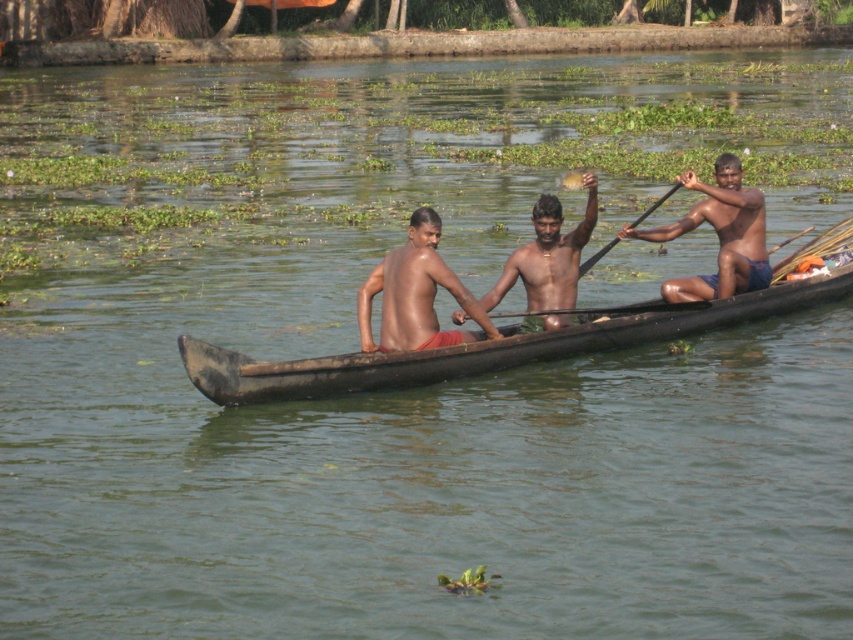
This screenshot has height=640, width=853. Describe the element at coordinates (415, 292) in the screenshot. I see `matte skin man at center` at that location.

This screenshot has height=640, width=853. What are the coordinates of `matte skin man at center` in the screenshot? It's located at (415, 292).

At what (x,y) coordinates should I click in order to perform the action: click on matte skin man at center. Please return your answer as a coordinate pair (x, y). Looking at the image, I should click on pos(415,292).

Can you confirm if dark brown wooden boat at center is taller than brown skin man at center?

Incorrect, dark brown wooden boat at center's height is not larger of brown skin man at center's.

Which is more to the left, dark brown wooden boat at center or brown skin man at center?

Positioned to the left is dark brown wooden boat at center.

Identify the location of dark brown wooden boat at center. The width and height of the screenshot is (853, 640). (492, 346).

Does shiny blue shorts at right have a lesser width compared to brown skin man at center?

Incorrect, shiny blue shorts at right's width is not less than brown skin man at center's.

Does shiny blue shorts at right appear under brown skin man at center?

Incorrect, shiny blue shorts at right is not positioned below brown skin man at center.

Identify the location of shiny blue shorts at right. (718, 236).